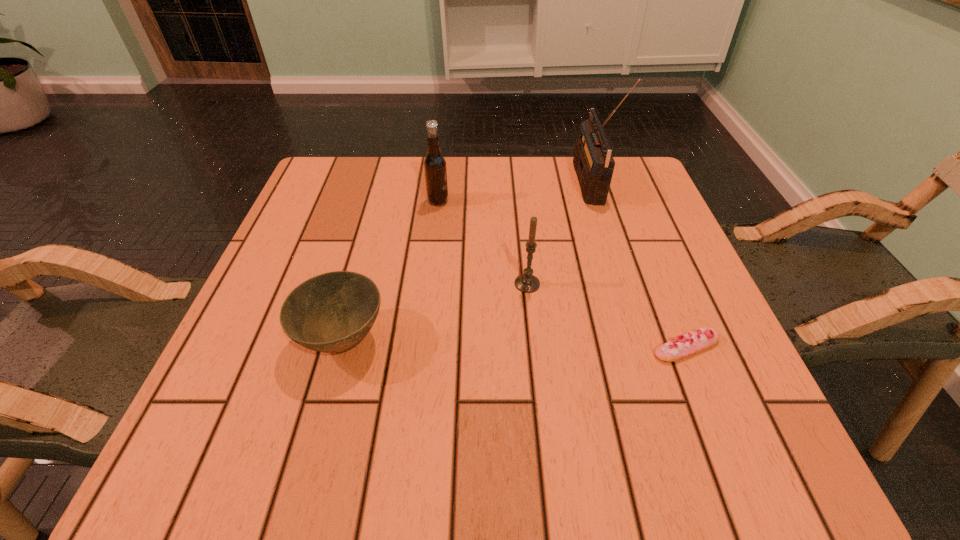
In order to click on object at the far right corner in this screenshot , I will do `click(593, 161)`.

Locate an element on the screen. The image size is (960, 540). vacant space at the far edge of the desktop is located at coordinates (463, 191).

Find the location of a particular element. The image size is (960, 540). vacant area at the left edge of the desktop is located at coordinates (306, 351).

The width and height of the screenshot is (960, 540). Identify the location of vacant region at the right edge of the desktop. (713, 409).

Find the location of a particular element. free space at the far left corner is located at coordinates (342, 202).

The width and height of the screenshot is (960, 540). In the image, there is a desktop. Identify the location of vacant space at the near left corner. (199, 428).

Identify the location of vacant space at the far right corner of the desktop. (633, 168).

At what (x,y) coordinates should I click in order to perform the action: click on free space between the shortest object and the leftmost object. Please return your answer as a coordinate pair (x, y). Looking at the image, I should click on (515, 343).

Image resolution: width=960 pixels, height=540 pixels. In order to click on vacant area between the tallest object and the fourth object from right to left in this screenshot , I will do tap(514, 192).

Find the location of a particular element. vacant space in between the bowl and the shortest object is located at coordinates (515, 343).